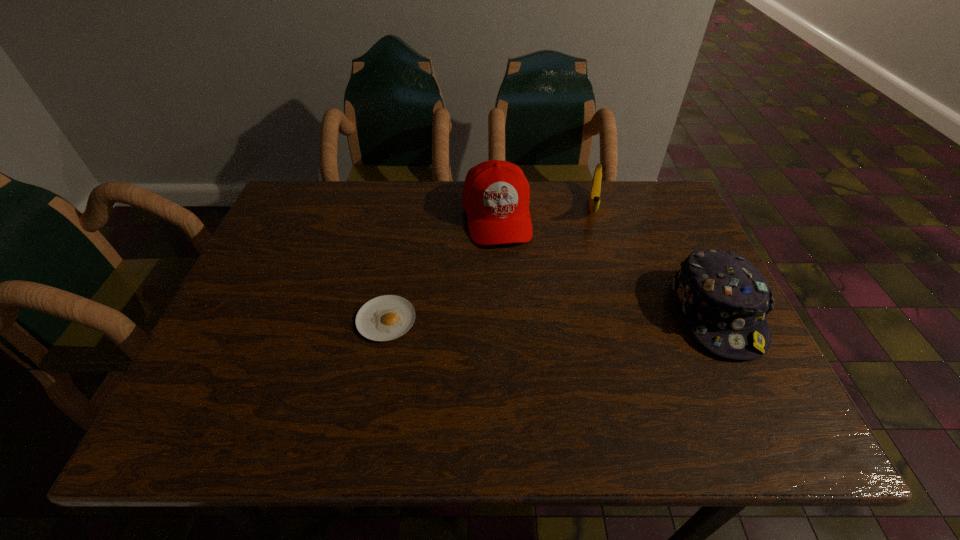
Where is `object at the near right corner`? The image size is (960, 540). object at the near right corner is located at coordinates (725, 299).

This screenshot has width=960, height=540. In the image, there is a desktop. What are the coordinates of `vacant space at the far edge` in the screenshot? It's located at (543, 194).

Where is `vacant space at the near edge of the desktop`? The width and height of the screenshot is (960, 540). vacant space at the near edge of the desktop is located at coordinates (421, 375).

Locate an element on the screen. The height and width of the screenshot is (540, 960). vacant space at the left edge of the desktop is located at coordinates (267, 339).

Identify the location of free space at the far left corner. This screenshot has height=540, width=960. (269, 231).

Identify the location of free area in between the third shortest object and the baseball cap. This screenshot has width=960, height=540. (607, 265).

You are a GUI agent. You are given a task and a screenshot of the screen. Output one action in this format:
    pyautogui.click(x=<x>, y=<y>)
    Task: Click on the empty space that is in between the headwear and the second object from right to left
    The width and height of the screenshot is (960, 540).
    Given the screenshot: What is the action you would take?
    pyautogui.click(x=655, y=259)

Where is `vacant area that lies between the baseball cap and the third shortest object`? vacant area that lies between the baseball cap and the third shortest object is located at coordinates (607, 265).

Locate an element on the screen. This screenshot has height=540, width=960. vacant space in between the headwear and the second shortest object is located at coordinates (655, 259).

You are a GUI agent. You are given a task and a screenshot of the screen. Output one action in this format:
    pyautogui.click(x=<x>, y=<y>)
    Task: Click on the free spot between the second object from left to right and the second object from right to left
    This screenshot has width=960, height=540.
    Given the screenshot: What is the action you would take?
    pyautogui.click(x=544, y=211)